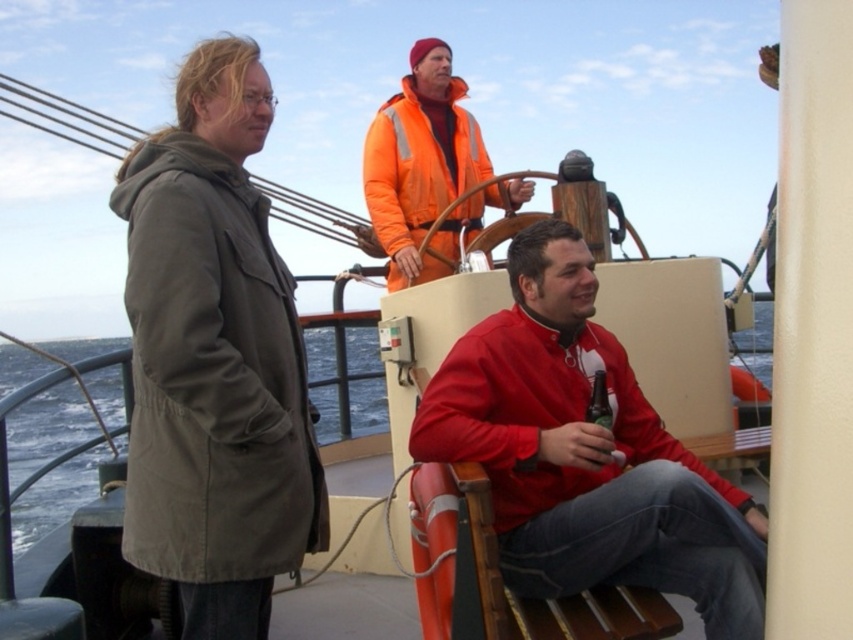
Is matte red jacket at center wider than green matte bottle at lower center?

Yes, matte red jacket at center is wider than green matte bottle at lower center.

Between point (524, 499) and point (601, 406), which one is positioned in front?

Point (524, 499)

At what (x,y) coordinates should I click in order to perform the action: click on matte red jacket at center. Please return your answer as a coordinate pair (x, y). This screenshot has height=640, width=853. Looking at the image, I should click on (585, 452).

Is orange reflective jacket at upper center smaller than green matte bottle at lower center?

No, orange reflective jacket at upper center is not smaller than green matte bottle at lower center.

Which is in front, point (421, 275) or point (606, 406)?

Point (606, 406) is more forward.

Locate an element on the screen. orange reflective jacket at upper center is located at coordinates (416, 166).

Is matte red jacket at center below orange reflective jacket at upper center?

Correct, matte red jacket at center is located below orange reflective jacket at upper center.

How much distance is there between matte red jacket at center and orange reflective jacket at upper center?

matte red jacket at center and orange reflective jacket at upper center are 3.84 meters apart.

Image resolution: width=853 pixels, height=640 pixels. In order to click on matte red jacket at center in this screenshot , I will do `click(585, 452)`.

Locate an element on the screen. matte red jacket at center is located at coordinates (585, 452).